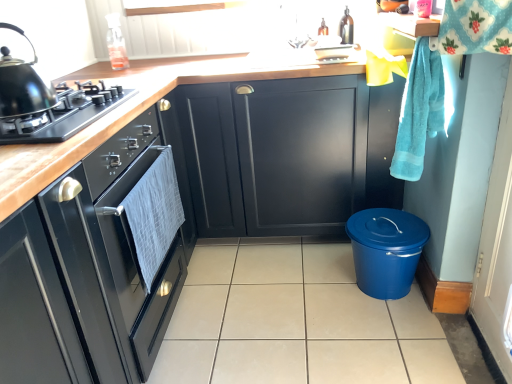
Question: Is black matte gas stove at left smaller than matte black cabinet at center, arranged as the 1th cabinetry when viewed from the back?

Choices:
 (A) yes
 (B) no

Answer: (A)

Question: Can you confirm if black matte gas stove at left is shorter than matte black cabinet at center, which is counted as the 3th cabinetry, starting from the front?

Choices:
 (A) yes
 (B) no

Answer: (A)

Question: Is black matte gas stove at left located outside matte black cabinet at center, arranged as the 1th cabinetry when viewed from the back?

Choices:
 (A) yes
 (B) no

Answer: (A)

Question: Is black matte gas stove at left directly adjacent to matte black cabinet at center, which is counted as the 3th cabinetry, starting from the front?

Choices:
 (A) no
 (B) yes

Answer: (A)

Question: Does black matte gas stove at left appear on the left side of matte black cabinet at center, arranged as the 1th cabinetry when viewed from the back?

Choices:
 (A) yes
 (B) no

Answer: (A)

Question: From the image's perspective, is matte black cabinets at center, the first cabinetry from the front, located above or below matte black cabinet at center, which is counted as the 3th cabinetry, starting from the front?

Choices:
 (A) above
 (B) below

Answer: (B)

Question: From their relative heights in the image, would you say matte black cabinets at center, the third cabinetry positioned from the back, is taller or shorter than matte black cabinet at center, arranged as the 1th cabinetry when viewed from the back?

Choices:
 (A) tall
 (B) short

Answer: (B)

Question: Do you think matte black cabinets at center, the first cabinetry from the front, is within matte black cabinet at center, which is counted as the 3th cabinetry, starting from the front, or outside of it?

Choices:
 (A) outside
 (B) inside

Answer: (A)

Question: Considering the positions of point (197, 203) and point (352, 187), is point (197, 203) closer or farther from the camera than point (352, 187)?

Choices:
 (A) farther
 (B) closer

Answer: (A)

Question: Is turquoise terry cloth hand towel at right spatially inside black matte gas stove at left, or outside of it?

Choices:
 (A) outside
 (B) inside

Answer: (A)

Question: Looking at the image, does turquoise terry cloth hand towel at right seem bigger or smaller compared to black matte gas stove at left?

Choices:
 (A) big
 (B) small

Answer: (B)

Question: Considering their positions, is turquoise terry cloth hand towel at right located in front of or behind black matte gas stove at left?

Choices:
 (A) front
 (B) behind

Answer: (B)

Question: Is point (428, 107) positioned closer to the camera than point (49, 129)?

Choices:
 (A) farther
 (B) closer

Answer: (A)

Question: Is shiny black kettle at left taller or shorter than beige tile at center?

Choices:
 (A) short
 (B) tall

Answer: (B)

Question: Considering the positions of shiny black kettle at left and beige tile at center in the image, is shiny black kettle at left bigger or smaller than beige tile at center?

Choices:
 (A) big
 (B) small

Answer: (B)